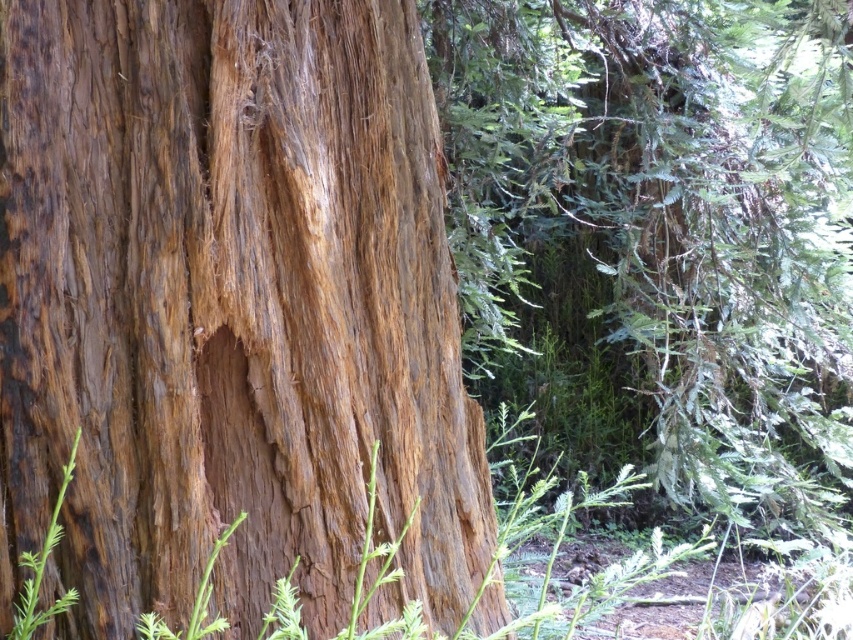
You are standing in front of the tree trunk and see two points marked on it. One is labeled as point [372,632] and the other as point [216,545]. Which point is closer to you?

Point [372,632] is in front of point [216,545], so it is closer to you.

You are a gardener who wants to plant a new flower between the green fuzzy plant at center and the green fibrous weed at lower left. The flower requires a minimum of 10 inches of space between plants. Can you plant it there?

The green fuzzy plant at center and green fibrous weed at lower left are 9.32 inches apart, which is less than the required 10 inches. Therefore, you cannot plant the flower between them as it does not meet the spacing requirement.

You are a botanist examining the tree trunk and notice two plants growing near the base. Which one is closer to you, the green rough stem at lower left or the green fibrous weed at lower left?

The green rough stem at lower left is closer to you because it is positioned further to the viewer than the green fibrous weed at lower left.